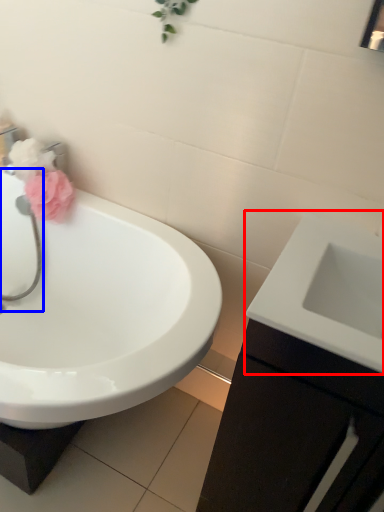
Question: Among these objects, which one is farthest to the camera, sink (highlighted by a red box) or plumbing fixture (highlighted by a blue box)?

Choices:
 (A) sink
 (B) plumbing fixture

Answer: (B)